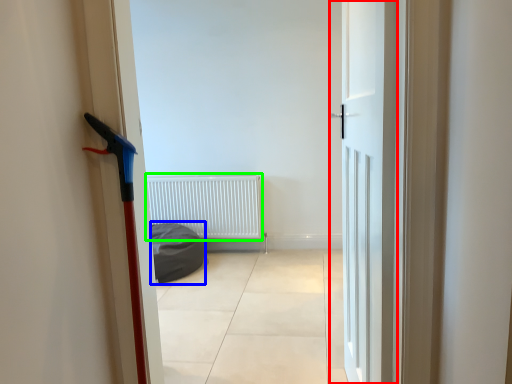
Question: Which is farther away from door (highlighted by a red box)? sleeping bag (highlighted by a blue box) or radiator (highlighted by a green box)?

Choices:
 (A) sleeping bag
 (B) radiator

Answer: (B)